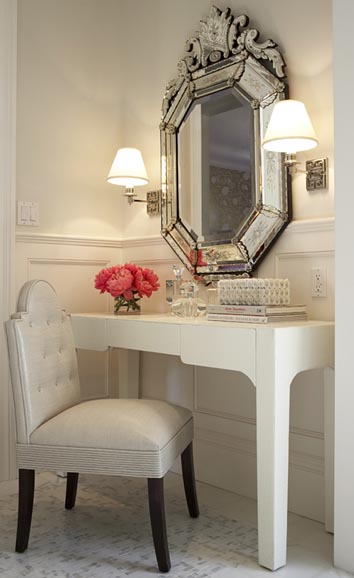
Where is `wall`? The width and height of the screenshot is (354, 578). wall is located at coordinates (67, 123).